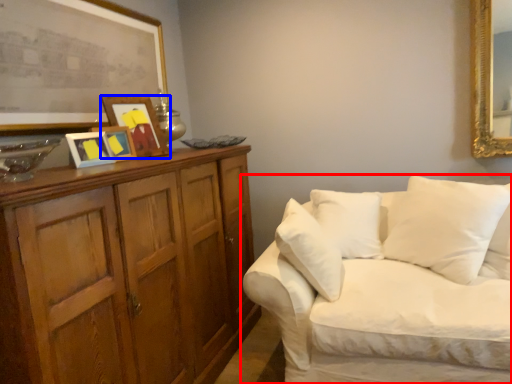
Question: Which point is closer to the camera, studio couch (highlighted by a red box) or picture frame (highlighted by a blue box)?

Choices:
 (A) studio couch
 (B) picture frame

Answer: (A)